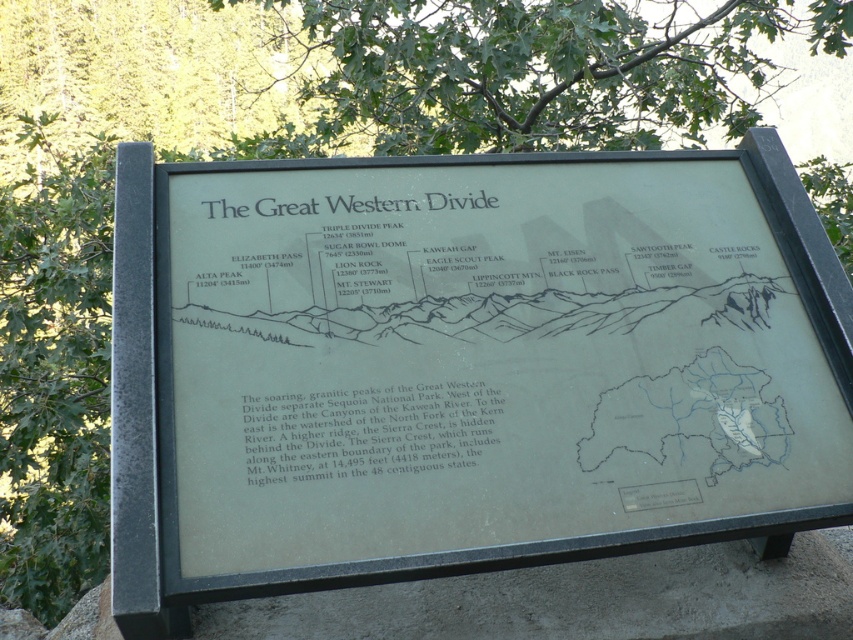
You are standing in front of the informational sign titled The Great Western Divide. You notice two points marked on the sign. The first point is at coordinates point (746, 246) and the second is at point (674, 486). From your perspective, which point appears closer to you?

Point (674, 486) appears closer because it is in front of point (746, 246) according to their positions on the sign.